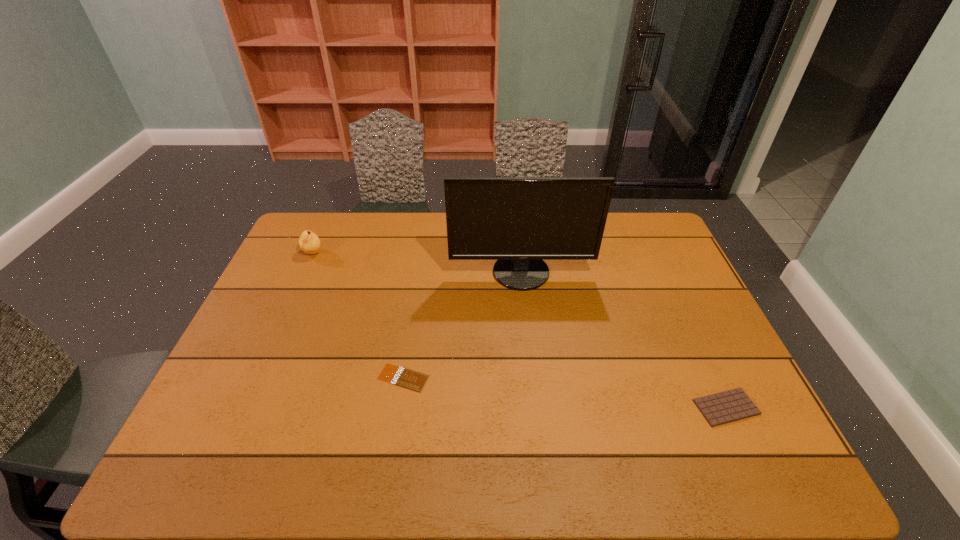
In order to click on the tallest object in this screenshot , I will do `click(519, 221)`.

Image resolution: width=960 pixels, height=540 pixels. Find the location of `monitor`. monitor is located at coordinates (519, 221).

This screenshot has height=540, width=960. In order to click on the leftmost object in this screenshot , I will do `click(309, 242)`.

Locate an element on the screen. The height and width of the screenshot is (540, 960). the second tallest object is located at coordinates (309, 242).

The height and width of the screenshot is (540, 960). Identify the location of the taller chocolate bar. (732, 405).

You are a GUI agent. You are given a task and a screenshot of the screen. Output one action in this format:
    pyautogui.click(x=<x>, y=<y>)
    Task: Click on the right chocolate bar
    The height and width of the screenshot is (540, 960).
    Given the screenshot: What is the action you would take?
    pyautogui.click(x=732, y=405)

Locate an element on the screen. the shorter chocolate bar is located at coordinates (403, 377).

Identify the location of the shortest object. Image resolution: width=960 pixels, height=540 pixels. click(x=403, y=377).

Identify the location of vacant space located 0.300m on the screen side of the second object from right to left. (531, 372).

Image resolution: width=960 pixels, height=540 pixels. What are the coordinates of `vacant area situated on the right of the third shortest object` in the screenshot? It's located at (347, 253).